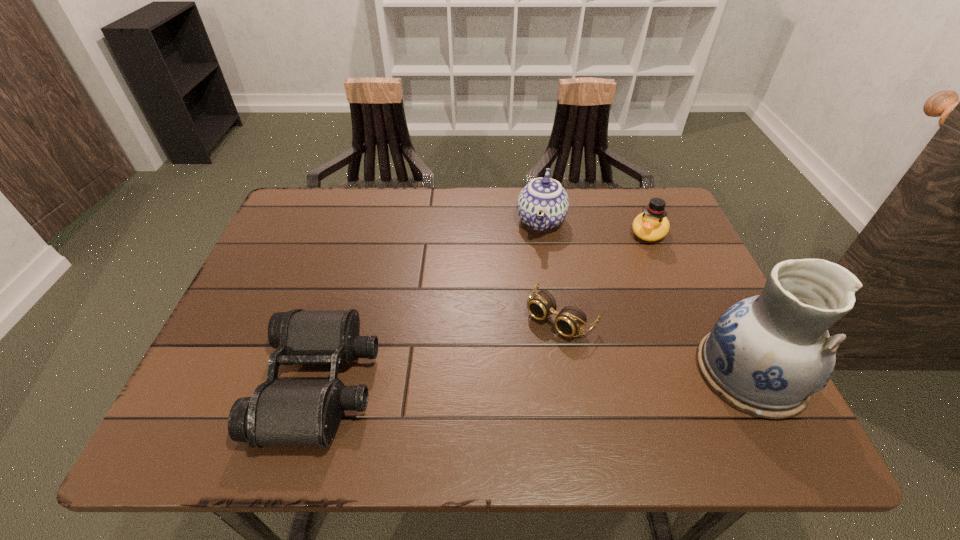
The width and height of the screenshot is (960, 540). In order to click on pottery located in the near edge section of the desktop in this screenshot , I will do `click(766, 355)`.

What are the coordinates of `object present at the left edge` in the screenshot? It's located at (281, 412).

Find the location of a particular element. pottery that is at the right edge is located at coordinates (766, 355).

The height and width of the screenshot is (540, 960). What are the coordinates of `duck that is at the right edge` in the screenshot? It's located at (651, 225).

Locate an element on the screen. Image resolution: width=960 pixels, height=540 pixels. object that is at the near left corner is located at coordinates (281, 412).

At what (x,y) coordinates should I click in order to perform the action: click on object located at the far right corner. Please return your answer as a coordinate pair (x, y). This screenshot has height=540, width=960. Looking at the image, I should click on (651, 225).

The height and width of the screenshot is (540, 960). I want to click on object positioned at the near right corner, so click(x=766, y=355).

In the image, there is a desktop. In order to click on vacant area at the far edge in this screenshot , I will do `click(576, 192)`.

Find the location of `vacant space at the near edge of the desktop`. vacant space at the near edge of the desktop is located at coordinates (484, 400).

You are a GUI agent. You are given a task and a screenshot of the screen. Output one action in this format:
    pyautogui.click(x=<x>, y=<y>)
    Task: Click on the free space at the left edge of the desktop
    
    Given the screenshot: What is the action you would take?
    pyautogui.click(x=237, y=321)